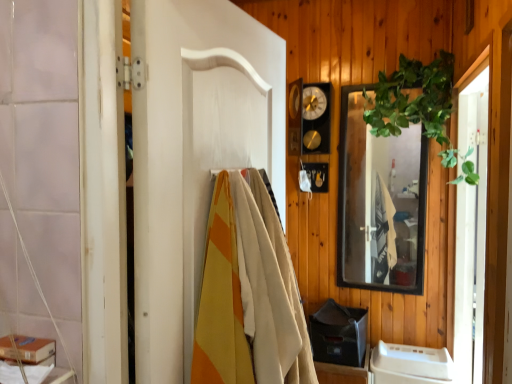
Question: From the image's perspective, would you say white plastic container at lower right is positioned over black glass mirror at upper right?

Choices:
 (A) yes
 (B) no

Answer: (B)

Question: Is black glass mirror at upper right surrounded by white plastic container at lower right?

Choices:
 (A) no
 (B) yes

Answer: (A)

Question: From a real-world perspective, is white plastic container at lower right under black glass mirror at upper right?

Choices:
 (A) no
 (B) yes

Answer: (B)

Question: Does white plastic container at lower right have a lesser width compared to black glass mirror at upper right?

Choices:
 (A) yes
 (B) no

Answer: (B)

Question: Considering the relative positions of white plastic container at lower right and black glass mirror at upper right in the image provided, is white plastic container at lower right to the right of black glass mirror at upper right from the viewer's perspective?

Choices:
 (A) no
 (B) yes

Answer: (B)

Question: Is white painted wood door at center spatially inside transparent glass screen door at right, or outside of it?

Choices:
 (A) outside
 (B) inside

Answer: (A)

Question: In terms of width, does white painted wood door at center look wider or thinner when compared to transparent glass screen door at right?

Choices:
 (A) wide
 (B) thin

Answer: (B)

Question: Looking at the image, does white painted wood door at center seem bigger or smaller compared to transparent glass screen door at right?

Choices:
 (A) small
 (B) big

Answer: (A)

Question: From a real-world perspective, is white painted wood door at center above or below transparent glass screen door at right?

Choices:
 (A) above
 (B) below

Answer: (A)

Question: Based on their sizes in the image, would you say green leafy plant at upper right is bigger or smaller than transparent glass screen door at right?

Choices:
 (A) small
 (B) big

Answer: (A)

Question: From the image's perspective, relative to transparent glass screen door at right, is green leafy plant at upper right above or below?

Choices:
 (A) above
 (B) below

Answer: (A)

Question: Would you say green leafy plant at upper right is to the left or to the right of transparent glass screen door at right in the picture?

Choices:
 (A) left
 (B) right

Answer: (A)

Question: Is green leafy plant at upper right spatially inside transparent glass screen door at right, or outside of it?

Choices:
 (A) outside
 (B) inside

Answer: (A)

Question: From the image's perspective, is white plastic container at lower right positioned above or below black glass mirror at upper right?

Choices:
 (A) above
 (B) below

Answer: (B)

Question: Based on their positions, is white plastic container at lower right located to the left or right of black glass mirror at upper right?

Choices:
 (A) left
 (B) right

Answer: (B)